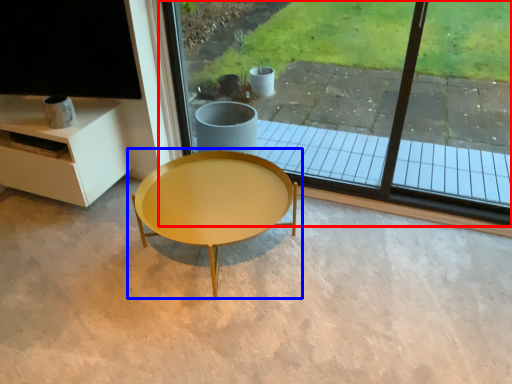
Question: Which of the following is the farthest to the observer, window (highlighted by a red box) or coffee table (highlighted by a blue box)?

Choices:
 (A) window
 (B) coffee table

Answer: (A)